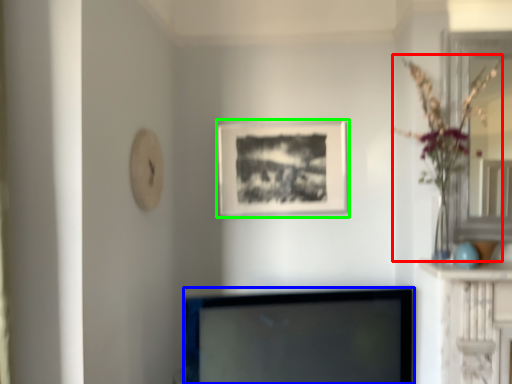
Question: Estimate the real-world distances between objects in this image. Which object is farther from floral arrangement (highlighted by a red box), television (highlighted by a blue box) or picture frame (highlighted by a green box)?

Choices:
 (A) television
 (B) picture frame

Answer: (A)